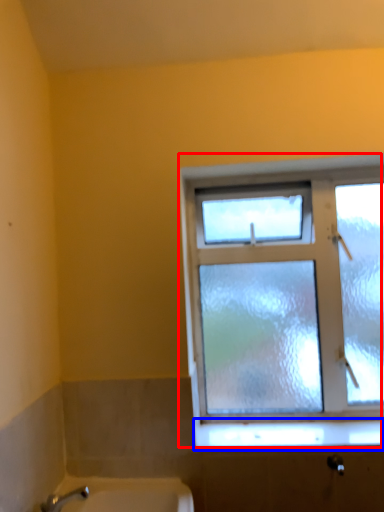
Question: Among these objects, which one is farthest to the camera, window (highlighted by a red box) or window sill (highlighted by a blue box)?

Choices:
 (A) window
 (B) window sill

Answer: (A)